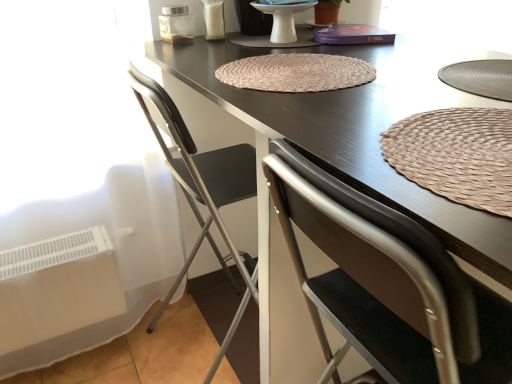
This screenshot has width=512, height=384. I want to click on free spot to the right of brown woven mat at center, arranged as the first mat when viewed from the top, so click(397, 68).